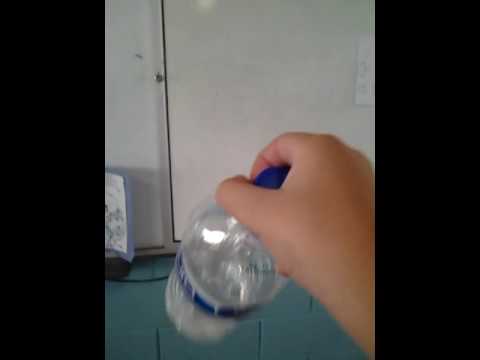
At what (x,y) coordinates should I click in order to perform the action: click on bottle. Please return your answer as a coordinate pair (x, y). Looking at the image, I should click on (223, 269).